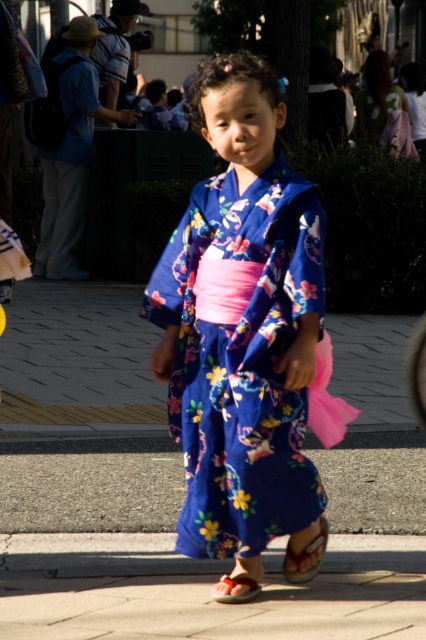
Question: Considering the relative positions of floral silk kimono at center and leather sandal at lower center in the image provided, where is floral silk kimono at center located with respect to leather sandal at lower center?

Choices:
 (A) above
 (B) below

Answer: (A)

Question: Is floral silk kimono at center positioned in front of leather sandal at lower center?

Choices:
 (A) yes
 (B) no

Answer: (A)

Question: Which object is positioned closest to the matte orange sandal at lower center?

Choices:
 (A) floral silk kimono at center
 (B) leather sandal at lower center

Answer: (B)

Question: Can you confirm if floral silk kimono at center is thinner than leather sandal at lower center?

Choices:
 (A) no
 (B) yes

Answer: (A)

Question: Among these points, which one is farthest from the camera?

Choices:
 (A) (195, 86)
 (B) (296, 560)

Answer: (A)

Question: Which point is closer to the camera?

Choices:
 (A) (298, 576)
 (B) (204, 324)

Answer: (B)